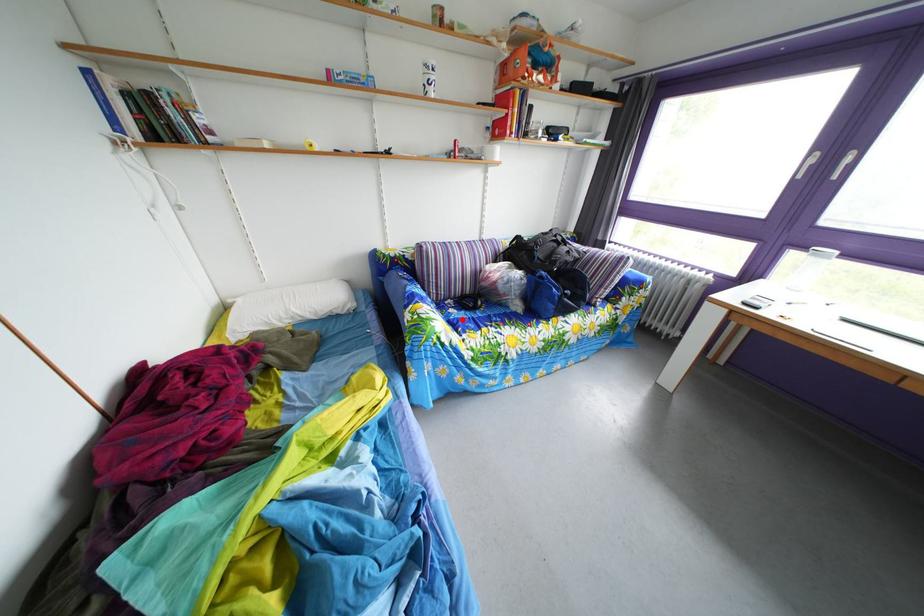
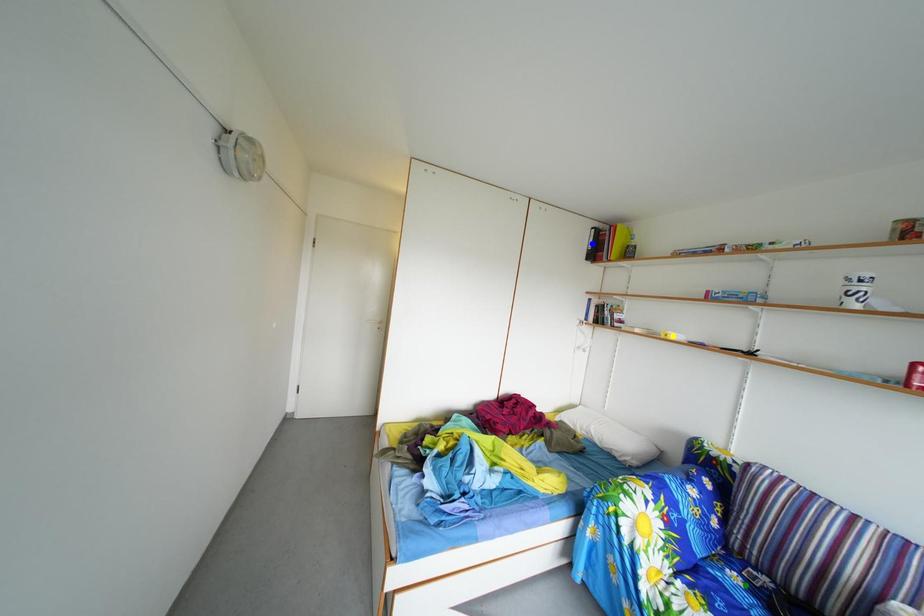
Question: I am providing you with two images of the same scene from different viewpoints. A red point is marked on the first image. You are given multiple points on the second image. Which point in image 2 represents the same 3d spot as the red point in image 1?

Choices:
 (A) yellow point
 (B) blue point
 (C) green point

Answer: (C)